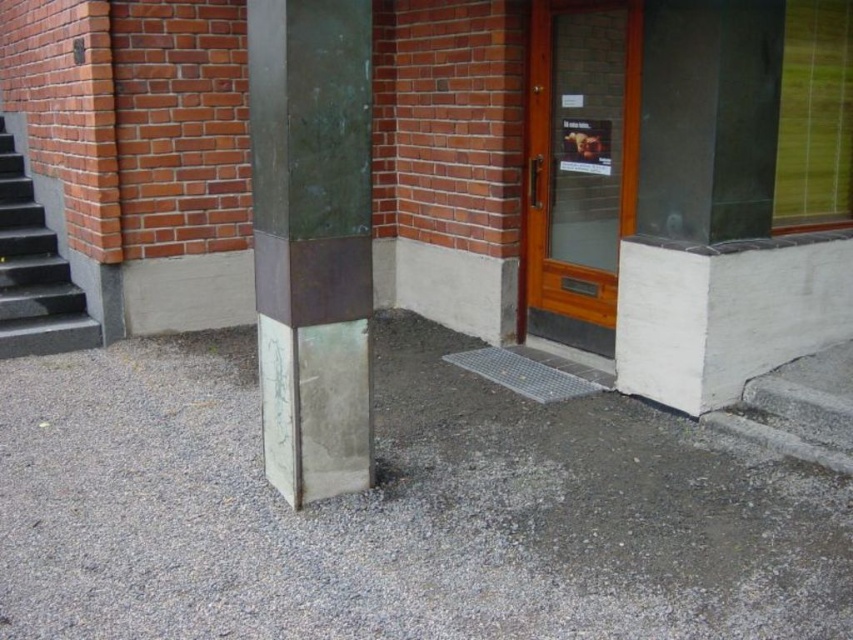
In the scene shown: You are standing at the entrance of the building and want to place a small decorative pot exactly where the green polished stone pillar at center is located. Is the spot suitable for placing the pot?

The green polished stone pillar at center is already located at point (312, 241), so placing the pot there would require removing the pillar first.

You are an architect designing a new building entrance. You need to place a decorative item next to the wooden door at center. Considering the green polished stone pillar at center is already there, which object is wider and should be considered for spacing?

The green polished stone pillar at center is wider than the wooden door at center, so you should consider the width of the green polished stone pillar at center when planning spacing for the decorative item.

You are an architect designing a new building entrance. You need to place a new decorative element between the green polished stone pillar at center and the black polished concrete stairs at left. Which object should the decorative element be placed closer to, considering their sizes?

The decorative element should be placed closer to the black polished concrete stairs at left because the green polished stone pillar at center has a smaller size compared to the black polished concrete stairs at left.